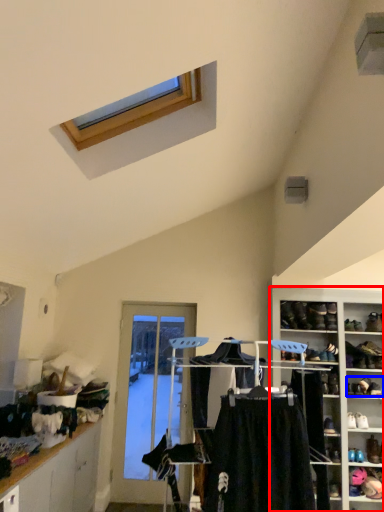
Question: Which object is closer to the camera taking this photo, shelf (highlighted by a red box) or footwear (highlighted by a blue box)?

Choices:
 (A) shelf
 (B) footwear

Answer: (A)